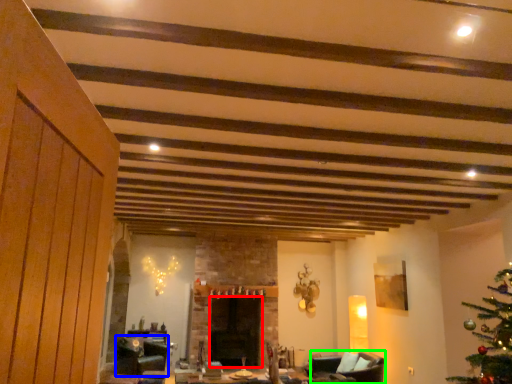
Question: Which object is the closest to the fireplace (highlighted by a red box)? Choose among these: swivel chair (highlighted by a blue box) or armchair (highlighted by a green box).

Choices:
 (A) swivel chair
 (B) armchair

Answer: (A)